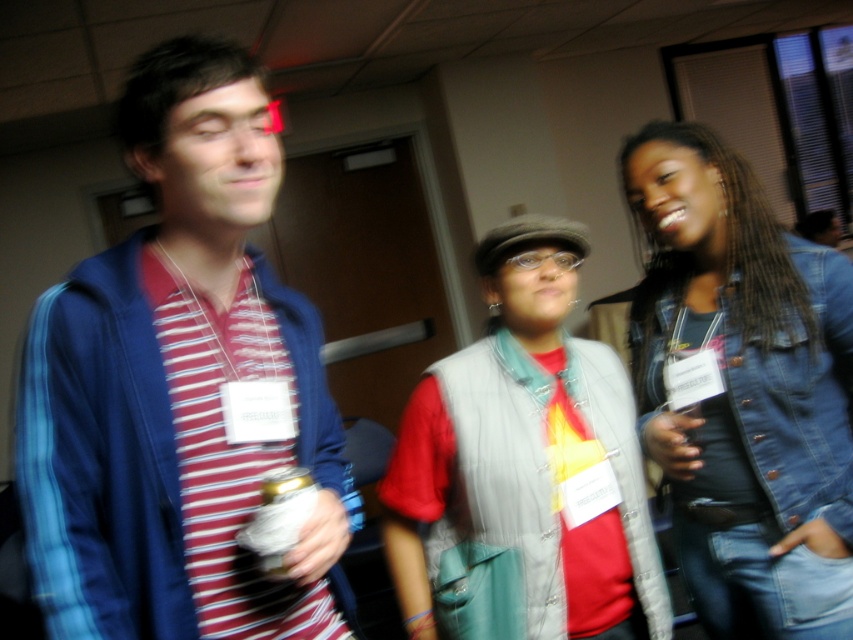
Between blue striped shirt at left and gray fabric vest at center, which one is positioned higher?

blue striped shirt at left

Can you confirm if blue striped shirt at left is wider than gray fabric vest at center?

In fact, blue striped shirt at left might be narrower than gray fabric vest at center.

This screenshot has width=853, height=640. Identify the location of blue striped shirt at left. (178, 387).

In order to click on blue striped shirt at left in this screenshot , I will do `click(178, 387)`.

Can you confirm if blue striped shirt at left is positioned to the right of denim jacket at right?

Incorrect, blue striped shirt at left is not on the right side of denim jacket at right.

Is blue striped shirt at left to the left of denim jacket at right from the viewer's perspective?

Correct, you'll find blue striped shirt at left to the left of denim jacket at right.

Between point (105, 492) and point (715, 241), which one is positioned in front?

Point (105, 492) is in front.

Find the location of a particular element. Image resolution: width=853 pixels, height=640 pixels. blue striped shirt at left is located at coordinates (178, 387).

Is denim jacket at right thinner than gray fabric vest at center?

Indeed, denim jacket at right has a lesser width compared to gray fabric vest at center.

Is denim jacket at right below gray fabric vest at center?

Incorrect, denim jacket at right is not positioned below gray fabric vest at center.

Is point (740, 212) closer to viewer compared to point (471, 380)?

That is False.

At what (x,y) coordinates should I click in order to perform the action: click on denim jacket at right. Please return your answer as a coordinate pair (x, y). This screenshot has height=640, width=853. Looking at the image, I should click on (744, 390).